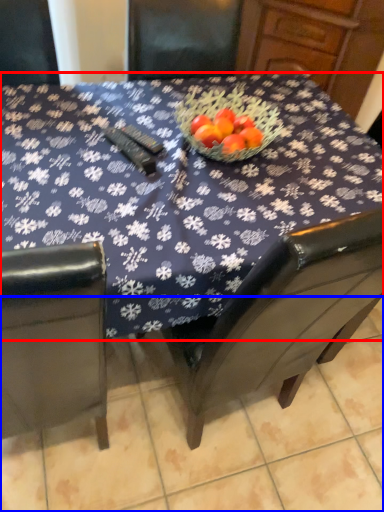
Question: Which object is further to the camera taking this photo, table (highlighted by a red box) or tile (highlighted by a blue box)?

Choices:
 (A) table
 (B) tile

Answer: (B)